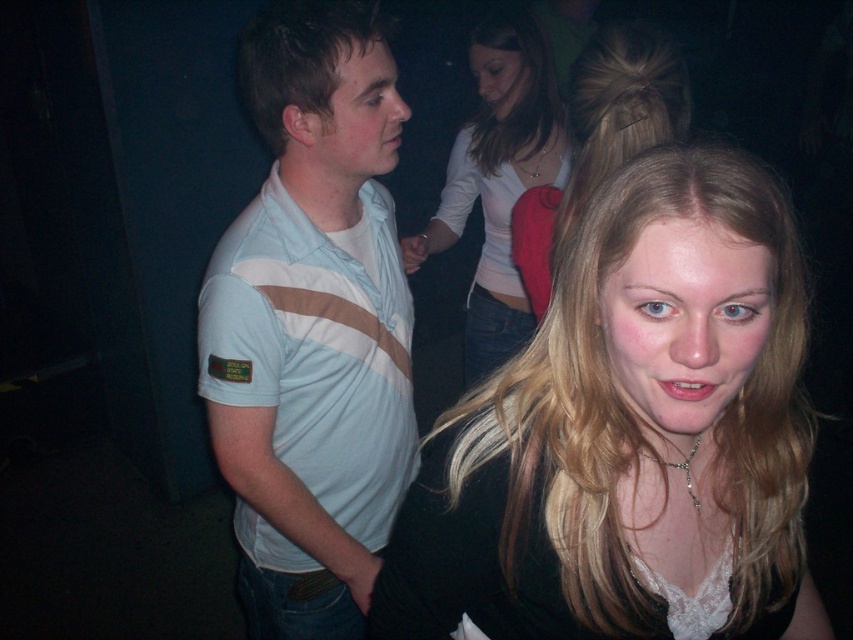
Which is behind, point (300, 348) or point (508, 182)?

Positioned behind is point (508, 182).

Does point (317, 468) lie in front of point (498, 104)?

Yes, it is.

Describe the element at coordinates (312, 324) in the screenshot. This screenshot has height=640, width=853. I see `light blue striped polo shirt at center` at that location.

Locate an element on the screen. This screenshot has height=640, width=853. light blue striped polo shirt at center is located at coordinates (312, 324).

Between blonde hair at center and matte white shirt at upper left, which one has less height?

With less height is matte white shirt at upper left.

This screenshot has height=640, width=853. I want to click on blonde hair at center, so click(x=630, y=435).

Identify the location of blonde hair at center. This screenshot has height=640, width=853. (630, 435).

Can you confirm if matte white shirt at center is shorter than matte white shirt at upper left?

No.

Between matte white shirt at center and matte white shirt at upper left, which one is positioned higher?

Positioned higher is matte white shirt at upper left.

Find the location of a particular element. The height and width of the screenshot is (640, 853). matte white shirt at center is located at coordinates (498, 180).

At what (x,y) coordinates should I click in order to perform the action: click on matte white shirt at center. Please return your answer as a coordinate pair (x, y). Looking at the image, I should click on (498, 180).